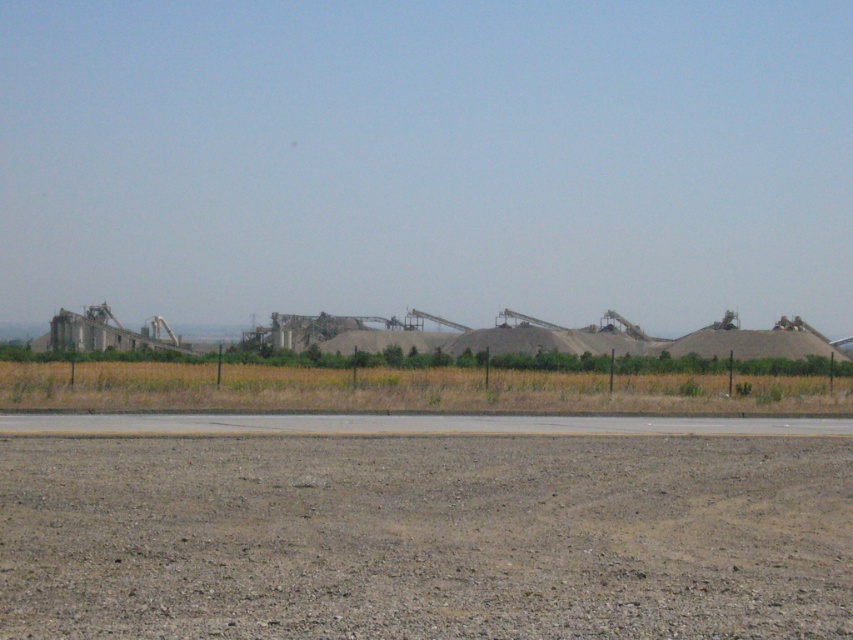
Does point (460, 442) come farther from viewer compared to point (682, 419)?

No, (460, 442) is in front of (682, 419).

The width and height of the screenshot is (853, 640). Describe the element at coordinates (425, 536) in the screenshot. I see `brown gravelly dirt at lower center` at that location.

Is point (578, 496) closer to viewer compared to point (0, 417)?

Yes, it is in front of point (0, 417).

Find the location of a particular element. Image resolution: width=853 pixels, height=640 pixels. brown gravelly dirt at lower center is located at coordinates (425, 536).